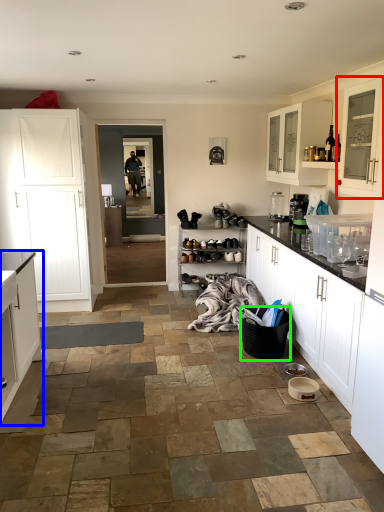
Question: Considering the real-world distances, which object is farthest from cabinetry (highlighted by a red box)? cabinetry (highlighted by a blue box) or basket (highlighted by a green box)?

Choices:
 (A) cabinetry
 (B) basket

Answer: (A)